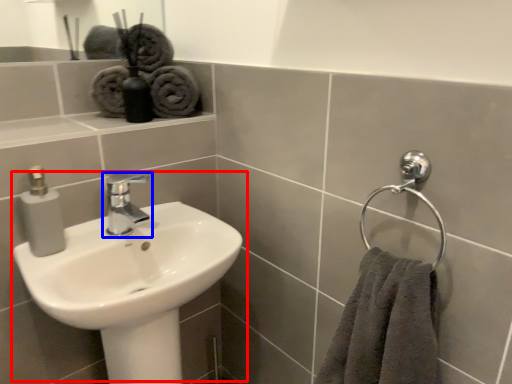
Question: Which of the following is the closest to the observer, sink (highlighted by a red box) or tap (highlighted by a blue box)?

Choices:
 (A) sink
 (B) tap

Answer: (A)